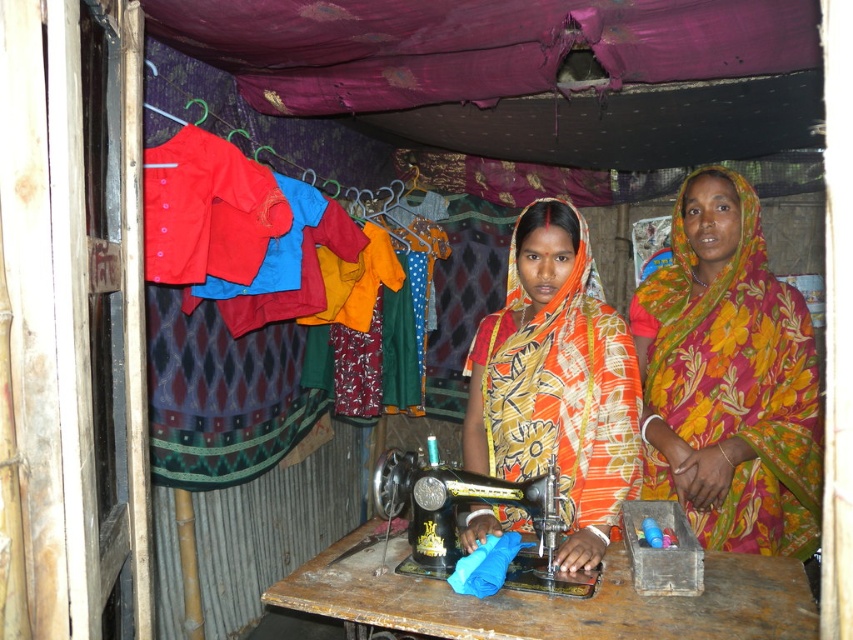
You are a tailor working in this sewing workshop. You need to place a 12 inch long decorative ribbon between the floral fabric saree at center and the printed cotton saree at center on the table. Will there be enough space to fit the ribbon between them?

The distance between the floral fabric saree at center and the printed cotton saree at center is 18.43 inches. Since the ribbon is only 12 inches long, there is sufficient space to place it between them.

You are a tailor working in this sewing workshop. You need to place a new spool of thread on the table. Where should you put it so it doesn not interfere with the black metal sewing machine at center and the floral fabric saree at center?

The floral fabric saree at center is above the black metal sewing machine at center, so placing the new spool of thread below the black metal sewing machine at center would keep it out of the way of both objects.